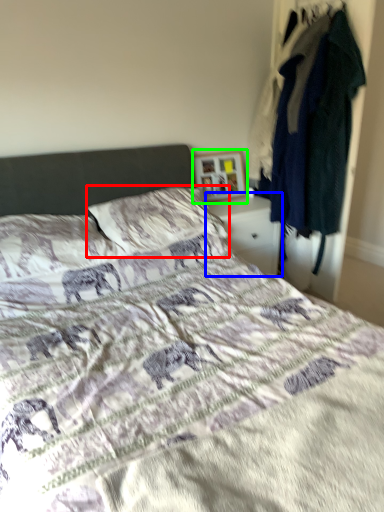
Question: Estimate the real-world distances between objects in this image. Which object is farther from pillow (highlighted by a red box), nightstand (highlighted by a blue box) or picture frame (highlighted by a green box)?

Choices:
 (A) nightstand
 (B) picture frame

Answer: (B)